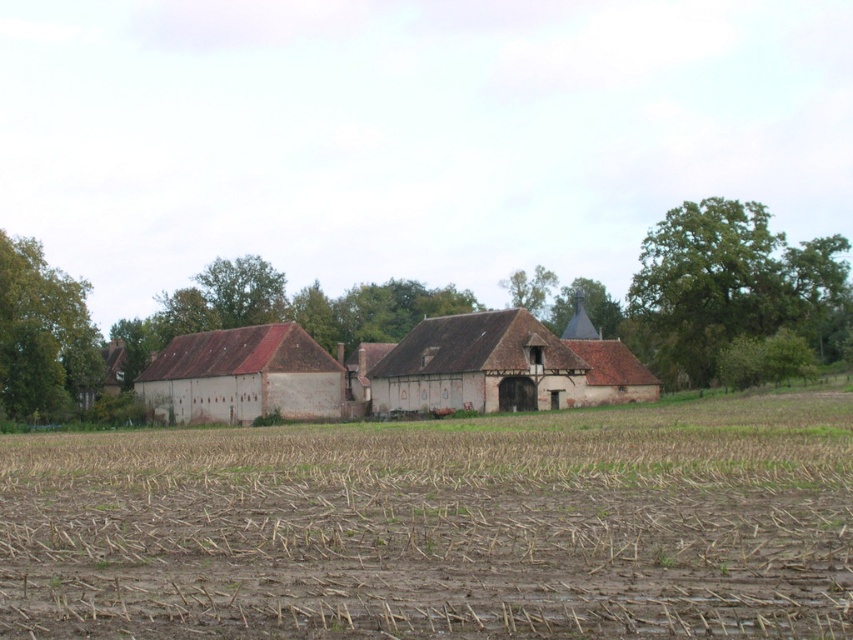
Question: Is brown soil at center bigger than matte brick barn at center?

Choices:
 (A) yes
 (B) no

Answer: (A)

Question: Which object is positioned closest to the green textured roof at center?

Choices:
 (A) green leafy tree at upper right
 (B) brown soil at center

Answer: (A)

Question: Which object is farther from the camera taking this photo?

Choices:
 (A) matte brick barn at center
 (B) green leafy tree at left
 (C) green leafy tree at upper center
 (D) brown soil at center

Answer: (C)

Question: Which point appears farthest from the camera in this image?

Choices:
 (A) (534, 307)
 (B) (251, 324)
 (C) (22, 330)
 (D) (341, 401)

Answer: (A)

Question: Is matte brick barn at center to the left of green leafy tree at upper center from the viewer's perspective?

Choices:
 (A) yes
 (B) no

Answer: (A)

Question: From the image, what is the correct spatial relationship of matte brick barn at center in relation to green leafy tree at center?

Choices:
 (A) right
 (B) left

Answer: (A)